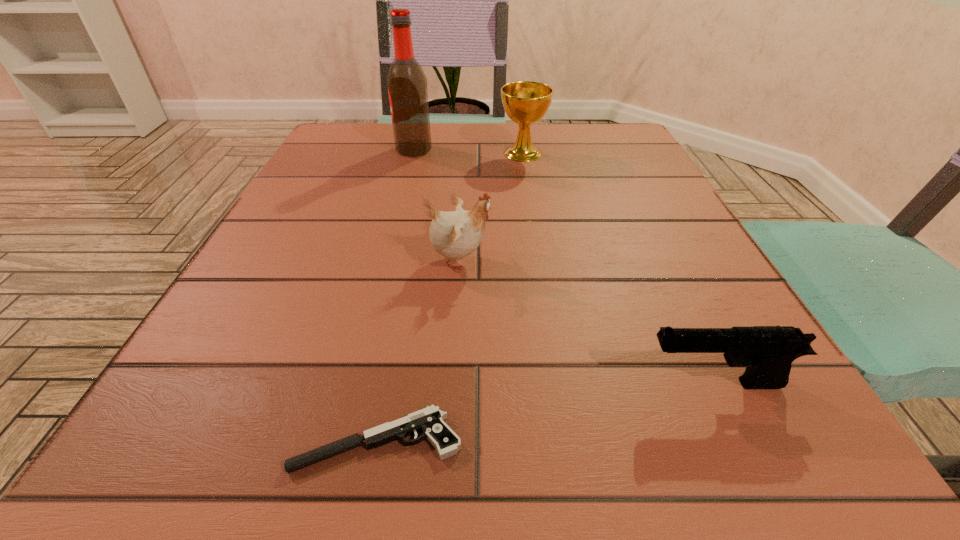
At what (x,y) coordinates should I click in order to perform the action: click on free spot at the far edge of the desktop. Please return your answer as a coordinate pair (x, y). Looking at the image, I should click on click(x=509, y=125).

This screenshot has height=540, width=960. Find the location of `vacant region at the near edge of the desktop`. vacant region at the near edge of the desktop is located at coordinates (359, 457).

Where is `vacant space at the left edge of the desktop`? vacant space at the left edge of the desktop is located at coordinates (338, 222).

You are a GUI agent. You are given a task and a screenshot of the screen. Output one action in this format:
    pyautogui.click(x=<x>, y=<y>)
    Task: Click on the free space at the right edge of the desktop
    
    Given the screenshot: What is the action you would take?
    pyautogui.click(x=644, y=171)

Find the location of `free spot at the far left corner of the desktop`. free spot at the far left corner of the desktop is located at coordinates (340, 140).

Find the location of a particular element. The width and height of the screenshot is (960, 540). vacant space at the near left corner is located at coordinates (120, 456).

Locate an element on the screen. The image size is (960, 540). vacant region at the far right corner of the desktop is located at coordinates (594, 138).

You are a GUI agent. You are given a task and a screenshot of the screen. Output one action in this format:
    pyautogui.click(x=<x>, y=<y>)
    Task: Click on the vacant space at the near right corner
    
    Given the screenshot: What is the action you would take?
    pyautogui.click(x=714, y=479)

Where is `blank region between the shortest object and the right pistol`? blank region between the shortest object and the right pistol is located at coordinates (547, 412).

I want to click on vacant area that lies between the fourth farthest object and the left pistol, so click(547, 412).